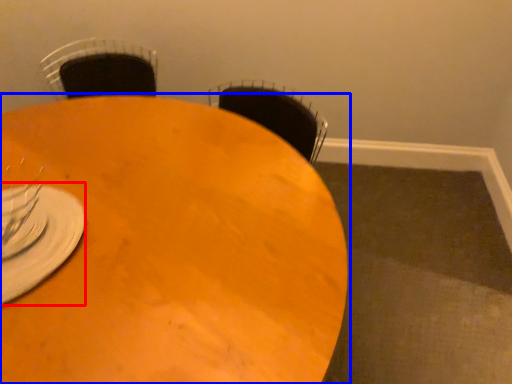
Question: Which object is further to the camera taking this photo, tableware (highlighted by a red box) or table (highlighted by a blue box)?

Choices:
 (A) tableware
 (B) table

Answer: (A)